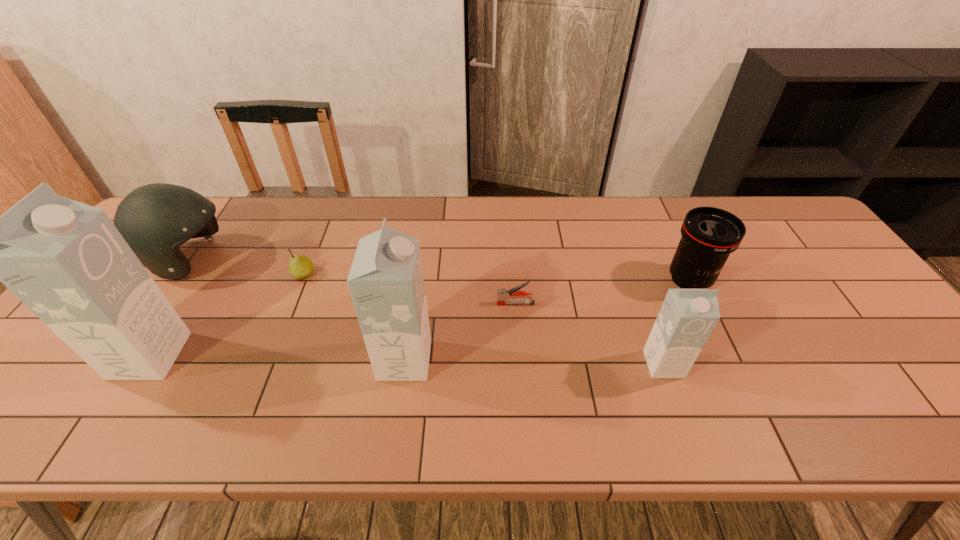
Where is `object situated at the far edge`? object situated at the far edge is located at coordinates (156, 219).

At what (x,y) coordinates should I click in order to perform the action: click on object that is at the left edge. Please return your answer as a coordinate pair (x, y). This screenshot has height=540, width=960. Looking at the image, I should click on (156, 219).

The height and width of the screenshot is (540, 960). Identify the location of object located at the far left corner. (156, 219).

This screenshot has width=960, height=540. I want to click on vacant point at the far edge, so click(588, 210).

Image resolution: width=960 pixels, height=540 pixels. In the image, there is a desktop. In order to click on free space at the near edge in this screenshot , I will do `click(731, 375)`.

Where is `free space at the near right corner of the desktop`? The width and height of the screenshot is (960, 540). free space at the near right corner of the desktop is located at coordinates (856, 368).

Find the location of `free point between the shortest object and the second tallest carton`. free point between the shortest object and the second tallest carton is located at coordinates (460, 332).

Identify the location of free area in between the telephoto lens and the third object from left to right. (496, 277).

Image resolution: width=960 pixels, height=540 pixels. I want to click on vacant region between the rightmost object and the pear, so click(496, 277).

Identify the location of free spot between the fourth nearest object and the sixth shortest object. The height and width of the screenshot is (540, 960). (460, 332).